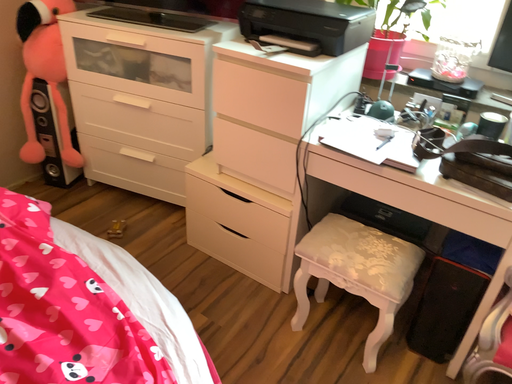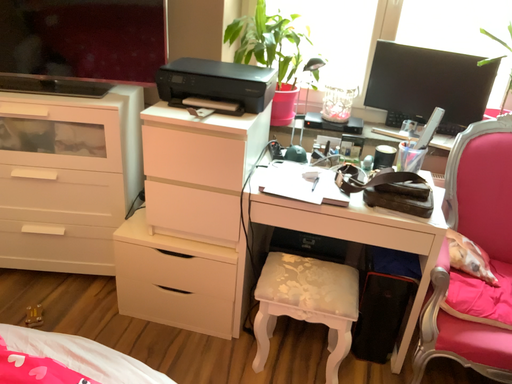
Question: How did the camera likely rotate when shooting the video?

Choices:
 (A) rotated right
 (B) rotated left

Answer: (A)